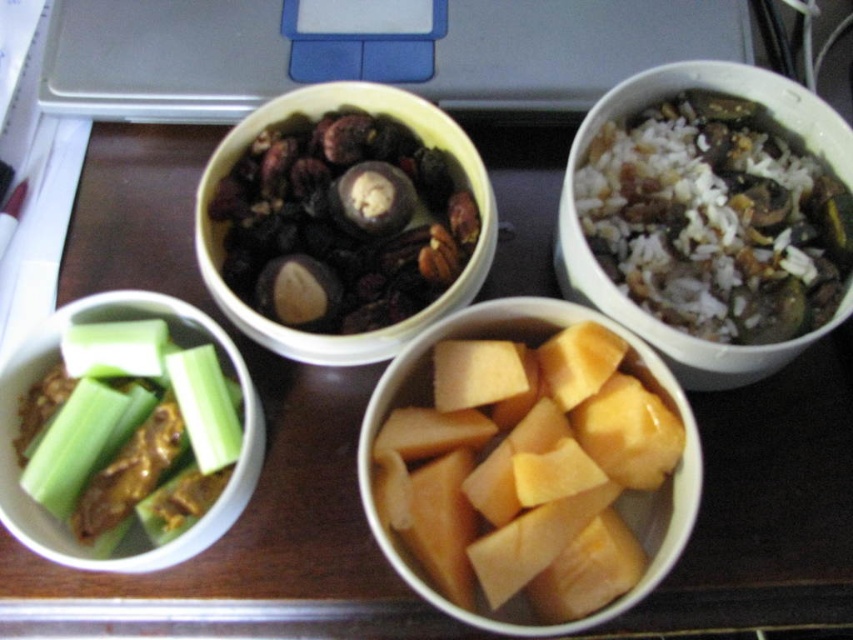
Question: Which point is farther from the camera taking this photo?

Choices:
 (A) (229, 500)
 (B) (788, 124)
 (C) (682, 528)
 (D) (212, 154)

Answer: (D)

Question: Can you confirm if white rice with vegetables at upper right is positioned to the right of green matte celery at lower left?

Choices:
 (A) no
 (B) yes

Answer: (B)

Question: Which point is closer to the camera?

Choices:
 (A) brown matte nuts and dried fruits at center
 (B) green matte celery at lower left
 (C) white rice with vegetables at upper right
 (D) yellowish matte pumpkin at center

Answer: (D)

Question: Which object is the closest to the brown matte nuts and dried fruits at center?

Choices:
 (A) white rice with vegetables at upper right
 (B) green matte celery at lower left
 (C) yellowish matte pumpkin at center

Answer: (B)

Question: Is yellowish matte pumpkin at center to the left of brown matte nuts and dried fruits at center from the viewer's perspective?

Choices:
 (A) no
 (B) yes

Answer: (A)

Question: Can you confirm if white rice with vegetables at upper right is thinner than brown matte nuts and dried fruits at center?

Choices:
 (A) no
 (B) yes

Answer: (B)